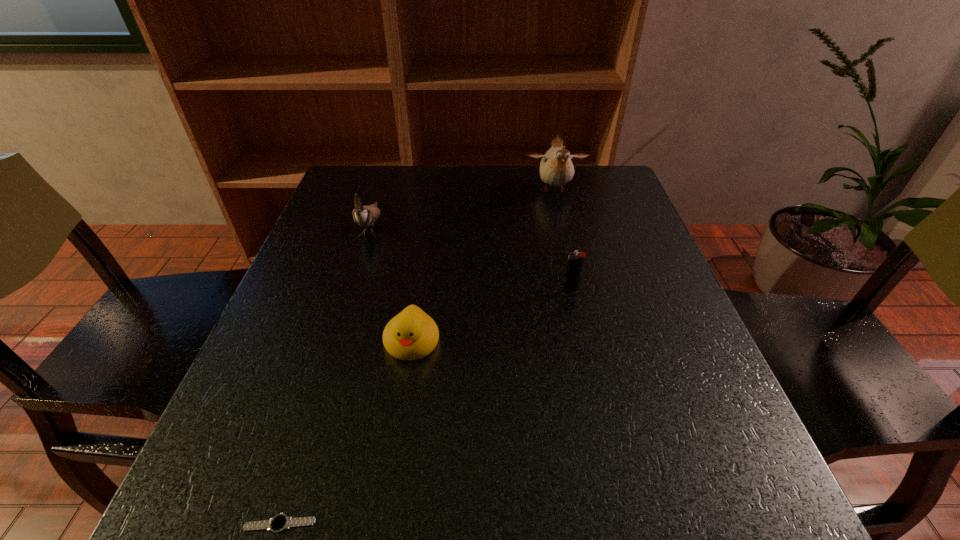
Identify the location of free space located at the beak of the farthest object. (580, 295).

Locate an element on the screen. vacant area located at the face of the nearer bird is located at coordinates (345, 308).

I want to click on vacant point located 0.360m on the front of the third shortest object, so click(609, 467).

In order to click on free space located 0.170m on the face of the fourth tallest object in this screenshot , I will do `click(395, 462)`.

This screenshot has width=960, height=540. What are the coordinates of `vacant space located 0.130m on the right of the watch` in the screenshot? It's located at (413, 523).

At what (x,y) coordinates should I click in order to perform the action: click on object that is at the near edge. Please return your answer as a coordinate pair (x, y). The height and width of the screenshot is (540, 960). Looking at the image, I should click on (279, 523).

This screenshot has height=540, width=960. In order to click on bird situated at the left edge in this screenshot , I will do `click(365, 216)`.

I want to click on watch that is positioned at the left edge, so click(279, 523).

I want to click on object situated at the right edge, so click(556, 167).

Find the location of a particular element. This screenshot has height=540, width=960. object at the far left corner is located at coordinates (365, 216).